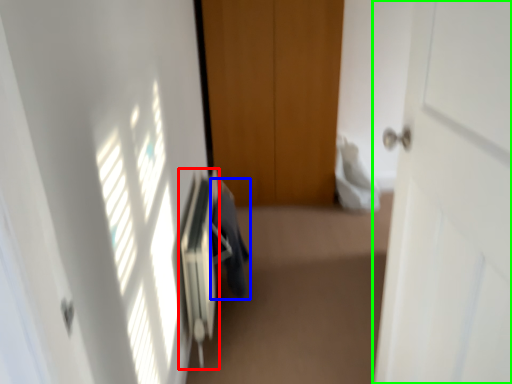
Question: Estimate the real-world distances between objects in this image. Which object is closer to radiator (highlighted by a red box), laundry (highlighted by a blue box) or door (highlighted by a green box)?

Choices:
 (A) laundry
 (B) door

Answer: (A)